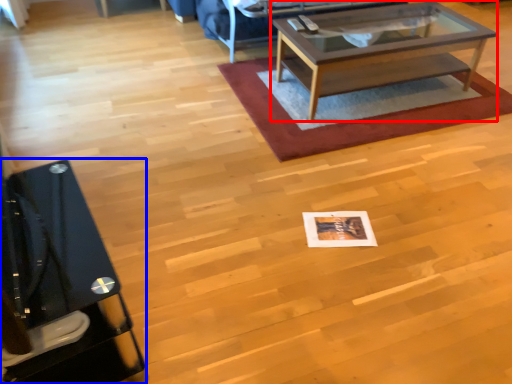
Question: Which object is closer to the camera taking this photo, coffee table (highlighted by a red box) or desk (highlighted by a blue box)?

Choices:
 (A) coffee table
 (B) desk

Answer: (B)